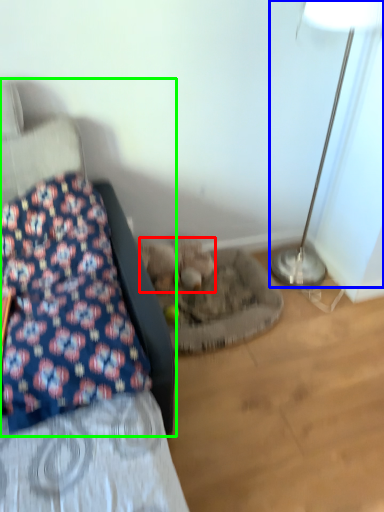
Question: Which object is the closest to the animal (highlighted by a red box)? Choose among these: lamp (highlighted by a blue box) or furniture (highlighted by a green box).

Choices:
 (A) lamp
 (B) furniture

Answer: (B)